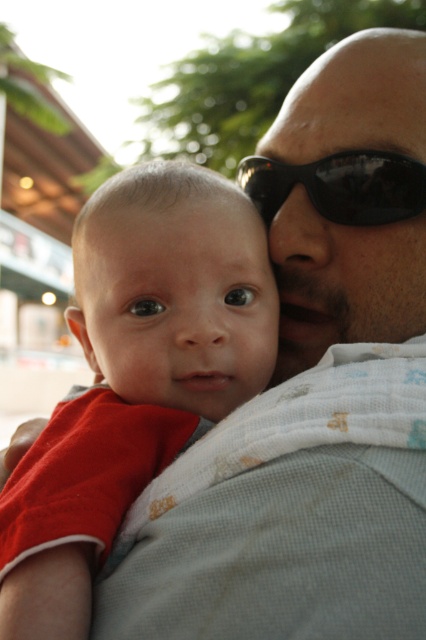
Identify the location of red cotton shirt at left. This screenshot has width=426, height=640. (135, 376).

Is red cotton shirt at left below black glossy sunglasses at center?

Yes, red cotton shirt at left is below black glossy sunglasses at center.

Is point (123, 266) farther from viewer compared to point (319, 160)?

No, it is not.

Find the location of a particular element. Image resolution: width=426 pixels, height=640 pixels. red cotton shirt at left is located at coordinates (135, 376).